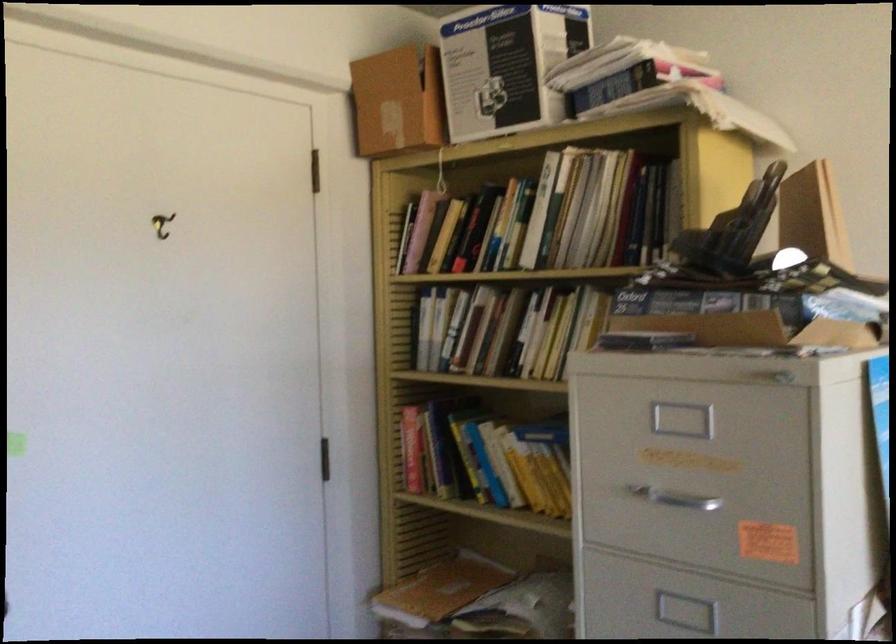
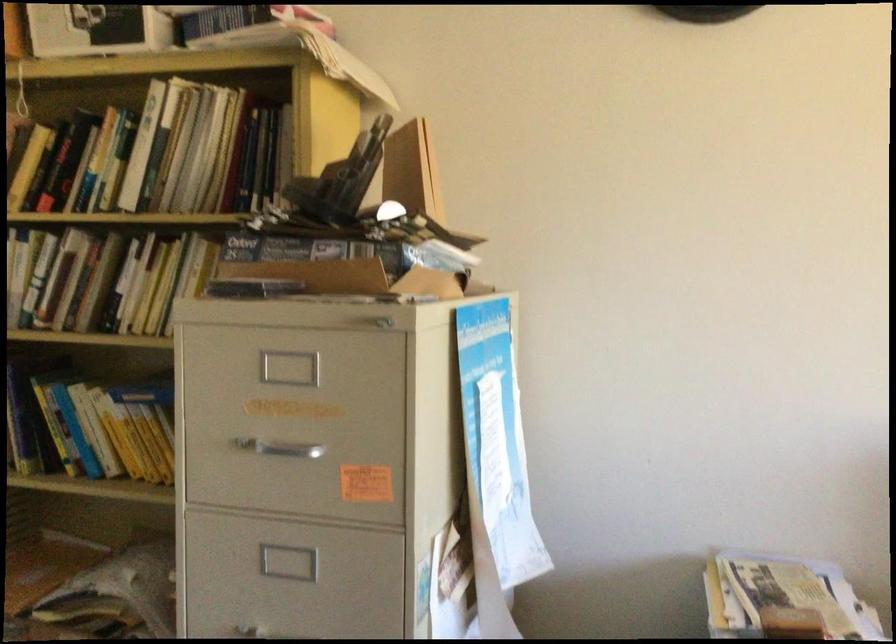
Question: The first image is from the beginning of the video and the second image is from the end. How did the camera likely rotate when shooting the video?

Choices:
 (A) Left
 (B) Right
 (C) Up
 (D) Down

Answer: (B)